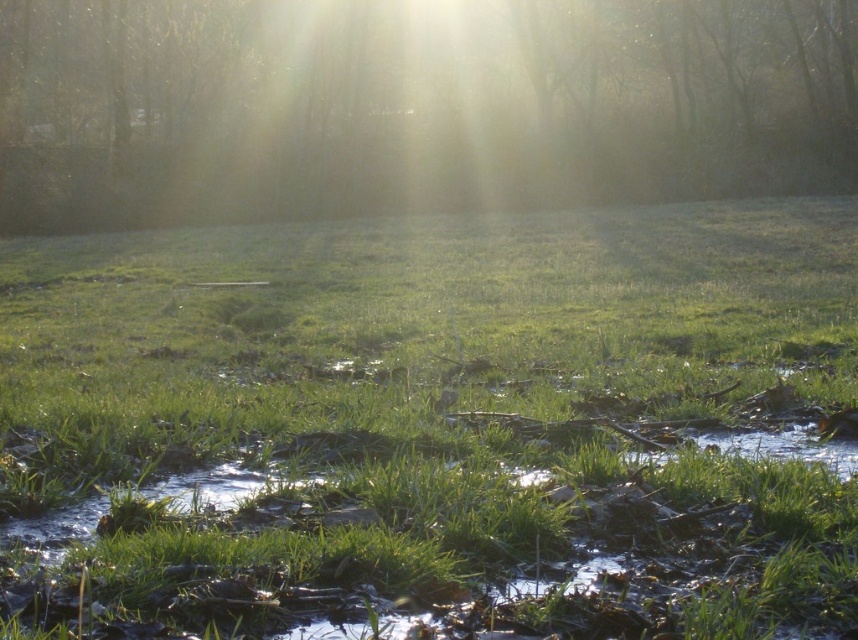
Can you confirm if green grassy at center is positioned above translucent foggy trees at upper center?

No.

How distant is green grassy at center from translucent foggy trees at upper center?

A distance of 23.42 meters exists between green grassy at center and translucent foggy trees at upper center.

Which is in front, point (559, 426) or point (276, 67)?

Positioned in front is point (559, 426).

Locate an element on the screen. The height and width of the screenshot is (640, 858). green grassy at center is located at coordinates (437, 426).